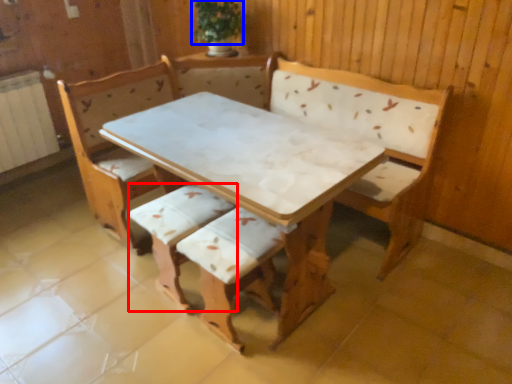
Question: Which object appears farthest to the camera in this image, armchair (highlighted by a red box) or plant (highlighted by a blue box)?

Choices:
 (A) armchair
 (B) plant

Answer: (B)